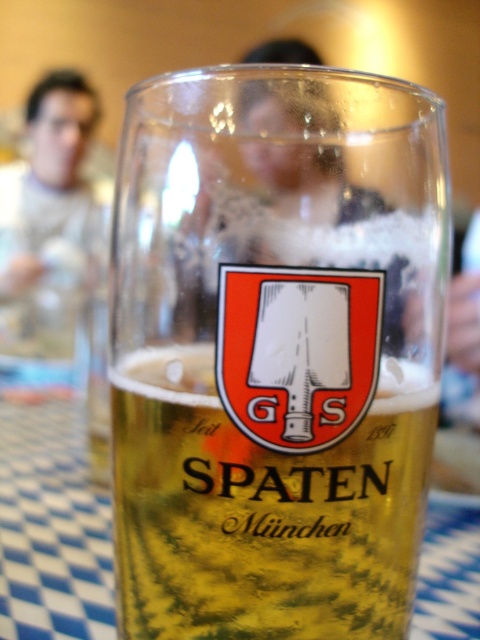
You are a bartender who needs to place a coaster under the transparent glass mug at center and the translucent glass beer at center. Which one should you place first to ensure the coaster is under both?

You should place the coaster under the transparent glass mug at center first because it is to the left of the translucent glass beer at center, so placing the mug first allows the coaster to be positioned correctly under both.

You are a bartender who needs to prepare a drink in the glass. Considering the transparent glass mug at center and the translucent glass beer at center, which one should you pour the beer into?

The transparent glass mug at center is larger in size than the translucent glass beer at center, so you should pour the beer into the transparent glass mug at center to ensure it can hold the beverage properly.

You are a bartender preparing a drink. You have a transparent glass mug at center and a translucent glass beer at center. Can the beer fit inside the mug without spilling?

The transparent glass mug at center is wider than the translucent glass beer at center, so the beer can fit inside the mug without spilling.